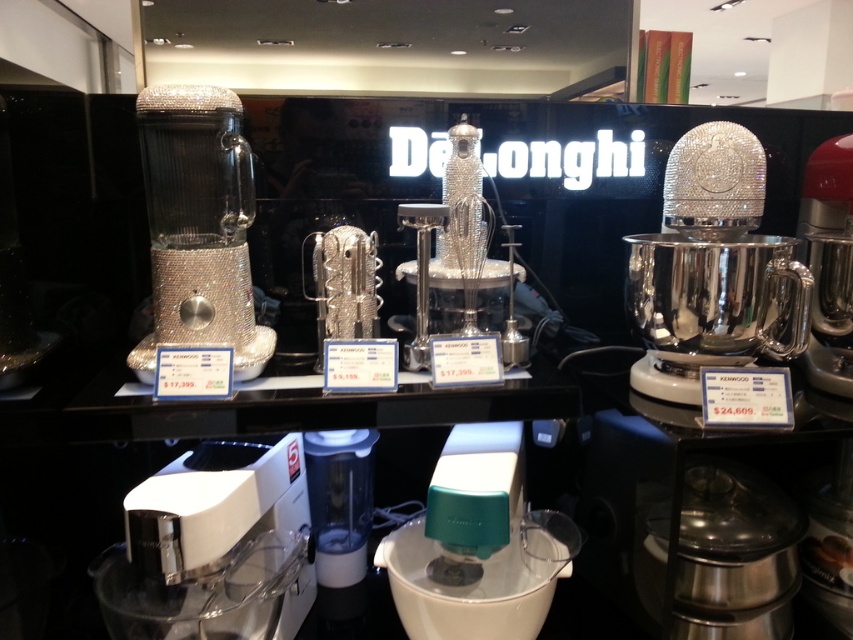
Is sparkly silver mixer at center shorter than red metallic mixer at right?

Incorrect, sparkly silver mixer at center's height does not fall short of red metallic mixer at right's.

Find the location of `sparkly silver mixer at center`. sparkly silver mixer at center is located at coordinates (473, 257).

Who is shorter, white plastic blender at center or sparkly silver mixer at center?

With less height is white plastic blender at center.

You are a GUI agent. You are given a task and a screenshot of the screen. Output one action in this format:
    pyautogui.click(x=<x>, y=<y>)
    Task: Click on the white plastic blender at center
    Image resolution: width=853 pixels, height=640 pixels.
    Given the screenshot: What is the action you would take?
    pyautogui.click(x=477, y=545)

Locate an element on the screen. white plastic blender at center is located at coordinates (477, 545).

Can you confirm if white plastic blender at center is taller than sparkly silver blender at left?

No, white plastic blender at center is not taller than sparkly silver blender at left.

Is point (405, 540) farther from camera compared to point (238, 200)?

Yes, point (405, 540) is behind point (238, 200).

Locate an element on the screen. The width and height of the screenshot is (853, 640). white plastic blender at center is located at coordinates tap(477, 545).